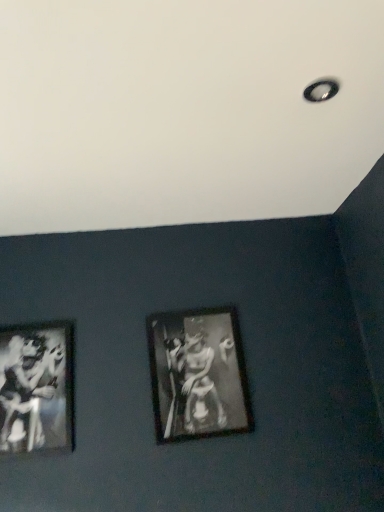
Question: Can you confirm if black matte picture frame at center is shorter than black glossy print at left?

Choices:
 (A) yes
 (B) no

Answer: (B)

Question: Is black glossy print at left surrounded by black matte picture frame at center?

Choices:
 (A) no
 (B) yes

Answer: (A)

Question: Is the depth of black matte picture frame at center less than that of black glossy print at left?

Choices:
 (A) no
 (B) yes

Answer: (A)

Question: Considering the relative positions of black matte picture frame at center and black glossy print at left in the image provided, is black matte picture frame at center behind black glossy print at left?

Choices:
 (A) yes
 (B) no

Answer: (A)

Question: Is black matte picture frame at center facing away from black glossy print at left?

Choices:
 (A) yes
 (B) no

Answer: (B)

Question: From a real-world perspective, is black matte picture frame at center on top of black glossy print at left?

Choices:
 (A) yes
 (B) no

Answer: (B)

Question: Can you confirm if black glossy print at left is thinner than black matte picture frame at center?

Choices:
 (A) yes
 (B) no

Answer: (A)

Question: Can you confirm if black glossy print at left is bigger than black matte picture frame at center?

Choices:
 (A) yes
 (B) no

Answer: (B)

Question: Is black matte picture frame at center inside black glossy print at left?

Choices:
 (A) yes
 (B) no

Answer: (B)

Question: From the image's perspective, would you say black glossy print at left is shown under black matte picture frame at center?

Choices:
 (A) no
 (B) yes

Answer: (B)

Question: Does black glossy print at left appear on the left side of black matte picture frame at center?

Choices:
 (A) no
 (B) yes

Answer: (B)

Question: Is black glossy print at left far away from black matte picture frame at center?

Choices:
 (A) yes
 (B) no

Answer: (B)

Question: Considering the positions of black glossy print at left and black matte picture frame at center in the image, is black glossy print at left taller or shorter than black matte picture frame at center?

Choices:
 (A) short
 (B) tall

Answer: (A)